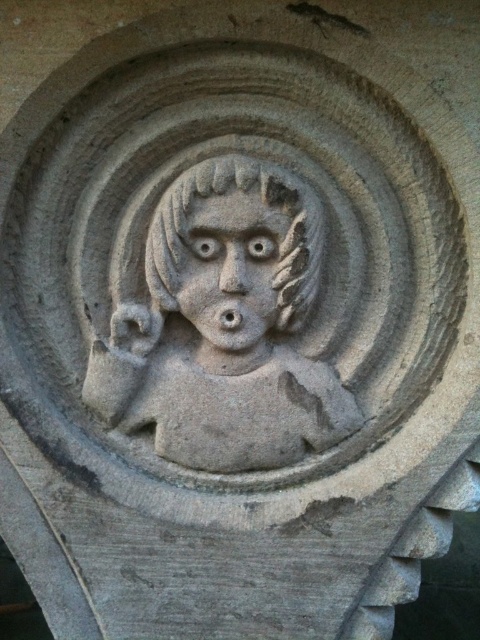
Question: From the image, what is the correct spatial relationship of gray stone deity at center in relation to stone textured face at center?

Choices:
 (A) right
 (B) left

Answer: (A)

Question: In this image, where is gray stone deity at center located relative to stone textured face at center?

Choices:
 (A) left
 (B) right

Answer: (B)

Question: Is gray stone deity at center positioned before stone textured face at center?

Choices:
 (A) yes
 (B) no

Answer: (A)

Question: Which object appears closest to the camera in this image?

Choices:
 (A) gray stone deity at center
 (B) stone textured face at center

Answer: (A)